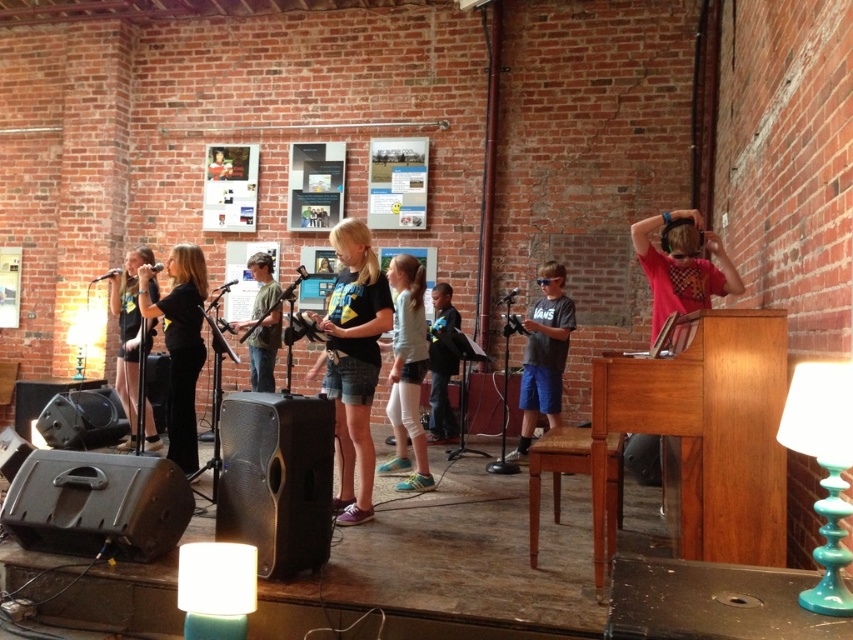
Which is below, matte gray t-shirt at center or blue denim jeans at center?

blue denim jeans at center

How distant is matte gray t-shirt at center from blue denim jeans at center?

28.67 inches

The width and height of the screenshot is (853, 640). Find the location of `matte gray t-shirt at center`. matte gray t-shirt at center is located at coordinates (544, 355).

The width and height of the screenshot is (853, 640). Identify the location of black denim shorts at center. (352, 362).

Is the position of black denim shorts at center more distant than that of blue denim jeans at center?

No, it is in front of blue denim jeans at center.

Is point (338, 396) behind point (442, 294)?

No, it is in front of (442, 294).

The image size is (853, 640). I want to click on black denim shorts at center, so click(352, 362).

Does black denim shorts at center appear on the left side of green cotton shirt at center?

In fact, black denim shorts at center is to the right of green cotton shirt at center.

Looking at this image, can you confirm if black denim shorts at center is shorter than green cotton shirt at center?

In fact, black denim shorts at center may be taller than green cotton shirt at center.

Where is `black denim shorts at center`? The height and width of the screenshot is (640, 853). black denim shorts at center is located at coordinates (352, 362).

This screenshot has height=640, width=853. I want to click on black denim shorts at center, so click(x=352, y=362).